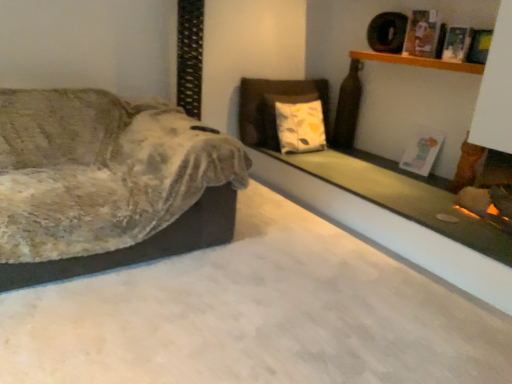
Question: Which is correct: velvet fabric couch at left is inside green matte glass at upper right, or outside of it?

Choices:
 (A) inside
 (B) outside

Answer: (B)

Question: From the image's perspective, is velvet fabric couch at left located above or below green matte glass at upper right?

Choices:
 (A) above
 (B) below

Answer: (A)

Question: Which object is the farthest from the green matte glass at upper right?

Choices:
 (A) velvet fabric couch at left
 (B) wooden shelf at upper right

Answer: (A)

Question: Which object is positioned farthest from the velvet fabric couch at left?

Choices:
 (A) wooden shelf at upper right
 (B) green matte glass at upper right

Answer: (A)